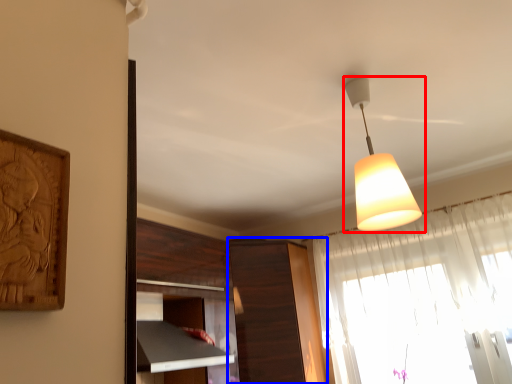
Question: Which object is further to the camera taking this photo, lamp (highlighted by a red box) or cabinetry (highlighted by a blue box)?

Choices:
 (A) lamp
 (B) cabinetry

Answer: (B)